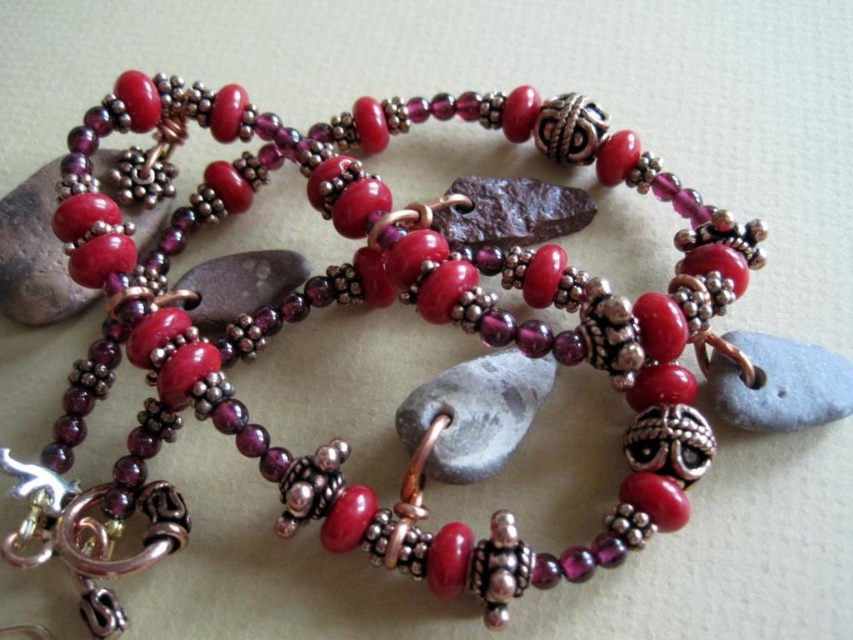
You are an artisan examining a necklace. You need to locate the matte silver stone at upper left. Where exactly is it positioned on the necklace?

The matte silver stone at upper left is positioned at point (x=35, y=253) on the necklace.

You are an artist trying to sketch the necklace from the image. You notice two points marked on the necklace. Which point is closer to you, point (18, 301) or point (715, 355)?

Point (715, 355) is closer to you because point (18, 301) is behind it.

You are an artisan examining the necklace. You need to choose a stone that can be easily handled for restringing. Which stone would be easier to handle, the matte silver stone at upper left or the gray matte stone at center?

The matte silver stone at upper left is larger in size than the gray matte stone at center, so it would be easier to handle for restringing.